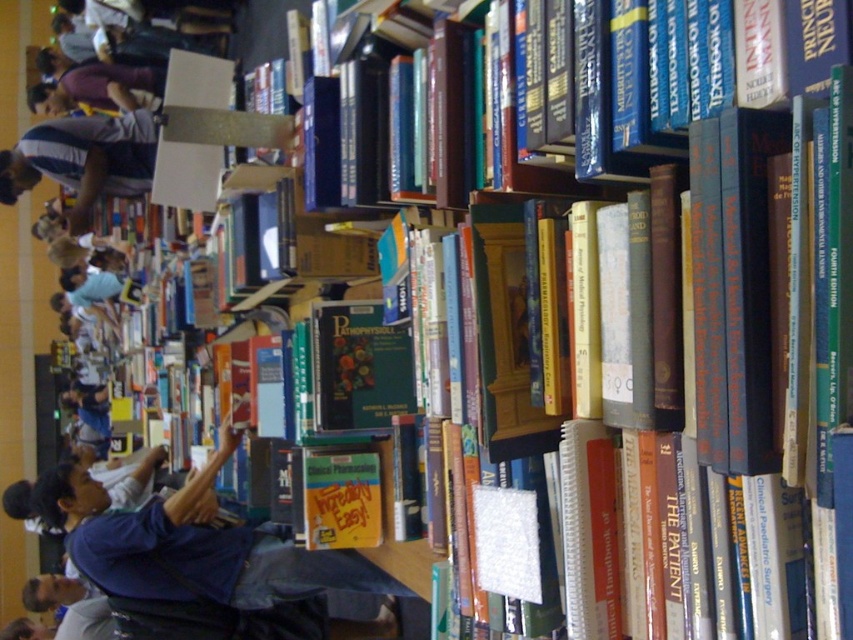
Locate an element on the screen. This screenshot has width=853, height=640. blue fabric jacket at lower left is located at coordinates (193, 545).

Does blue fabric jacket at lower left have a larger size compared to gray striped shirt at left?

Indeed, blue fabric jacket at lower left has a larger size compared to gray striped shirt at left.

Is point (84, 566) behind point (13, 173)?

No, it is in front of (13, 173).

This screenshot has width=853, height=640. Find the location of `blue fabric jacket at lower left`. blue fabric jacket at lower left is located at coordinates click(193, 545).